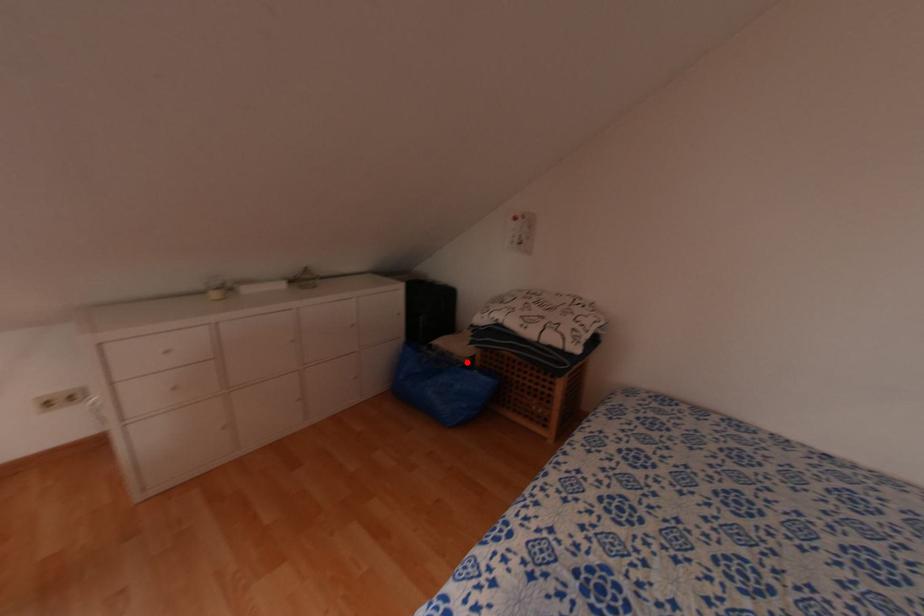
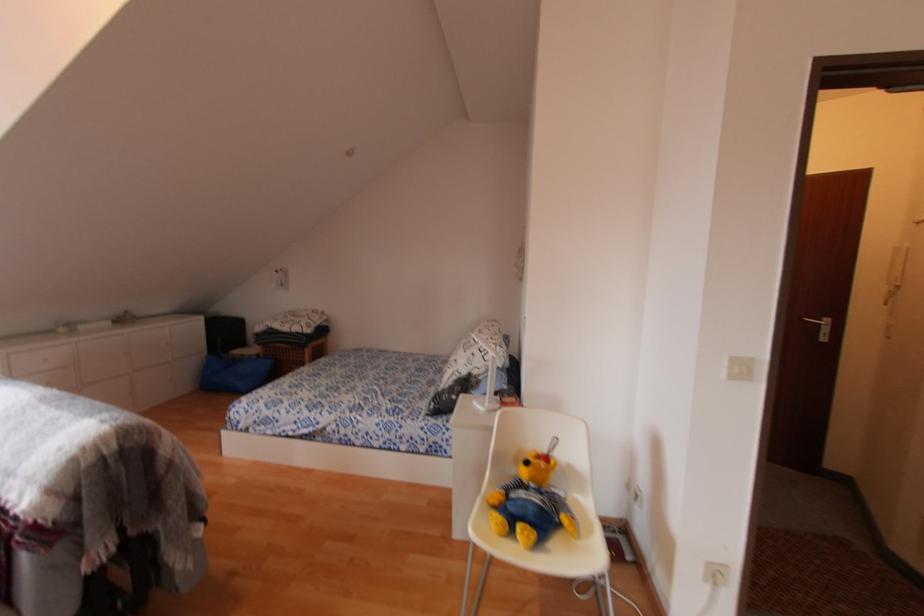
Question: I am providing you with two images of the same scene from different viewpoints. In image1, a red point is highlighted. Considering the same 3D point in image2, which of the following is correct?

Choices:
 (A) It is closer
 (B) It is farther

Answer: (B)